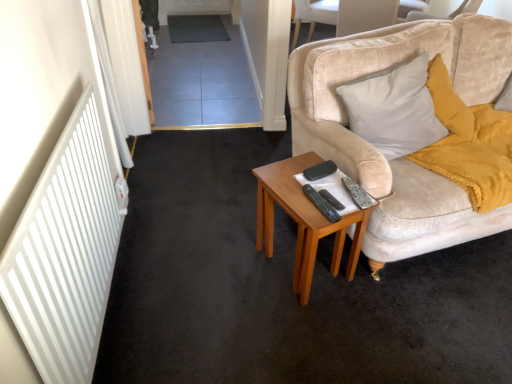
Locate an element on the screen. Image resolution: width=512 pixels, height=384 pixels. free location to the left of silver metallic remote control at right, the 1th remote control in the right-to-left sequence is located at coordinates (298, 198).